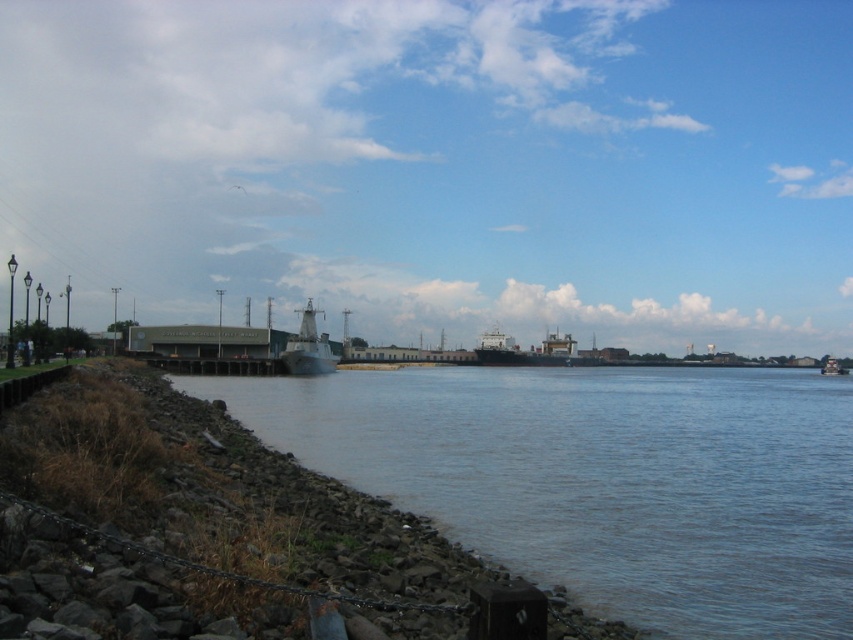
Between gray stone river at lower left and metallic gray ship at center, which one is positioned higher?

metallic gray ship at center is higher up.

Which is in front, point (764, 516) or point (300, 323)?

Positioned in front is point (764, 516).

Identify the location of gray stone river at lower left. (602, 480).